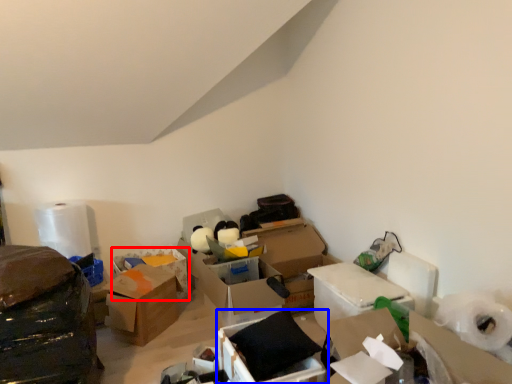
Question: Which point is further to the camera, box (highlighted by a red box) or box (highlighted by a blue box)?

Choices:
 (A) box
 (B) box

Answer: (A)